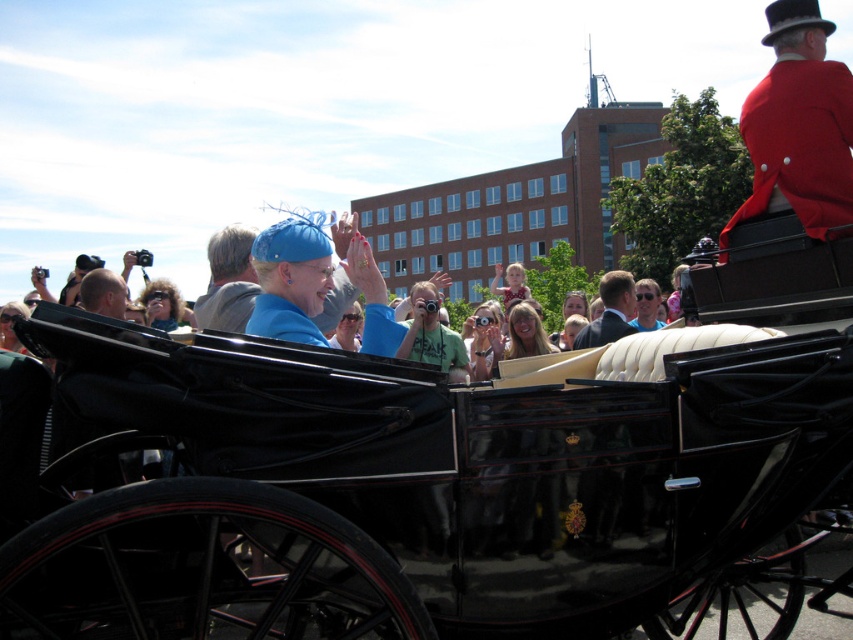
Does black polished wood horse cart at center have a smaller size compared to suit at center?

No, black polished wood horse cart at center is not smaller than suit at center.

At what (x,y) coordinates should I click in order to perform the action: click on black polished wood horse cart at center. Please return your answer as a coordinate pair (x, y). Looking at the image, I should click on 405,477.

Between point (619, 625) and point (589, 323), which one is positioned behind?

Positioned behind is point (589, 323).

Find the location of `black polished wood horse cart at center`. black polished wood horse cart at center is located at coordinates (405, 477).

Who is more distant from viewer, (225, 256) or (630, 333)?

Positioned behind is point (630, 333).

Is point (207, 288) in front of point (614, 269)?

Yes, point (207, 288) is in front of point (614, 269).

At what (x,y) coordinates should I click in order to perform the action: click on matte blue hat at center. Please return your answer as a coordinate pair (x, y). Looking at the image, I should click on (228, 282).

Does red wool coat at upper right have a lesser width compared to smooth bald head at center?

Incorrect, red wool coat at upper right's width is not less than smooth bald head at center's.

Is point (807, 148) farther from viewer compared to point (96, 292)?

No, (807, 148) is closer to viewer.

Where is `red wool coat at upper right`? The image size is (853, 640). red wool coat at upper right is located at coordinates (799, 125).